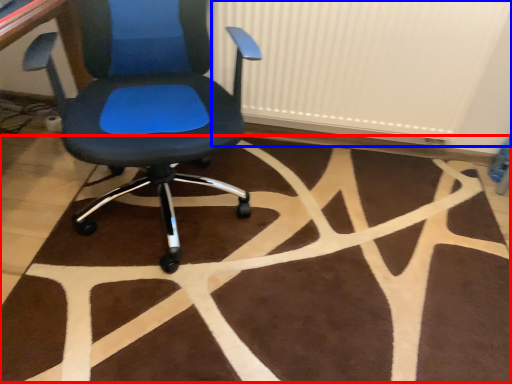
Question: Which object is closer to the camera taking this photo, mat (highlighted by a red box) or radiator (highlighted by a blue box)?

Choices:
 (A) mat
 (B) radiator

Answer: (A)